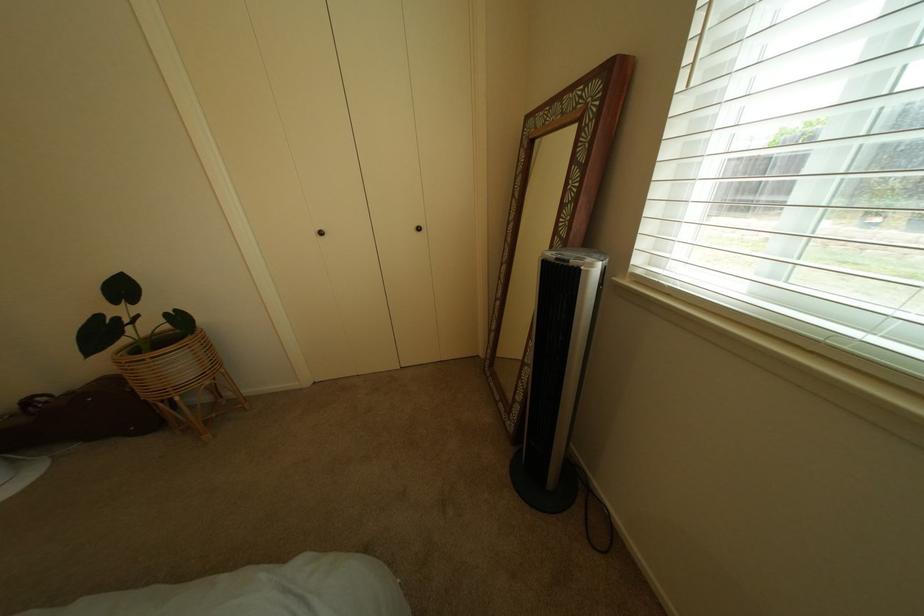
Where would you lift the black tower fan? Please return your answer as a coordinate pair (x, y).

(550, 361)